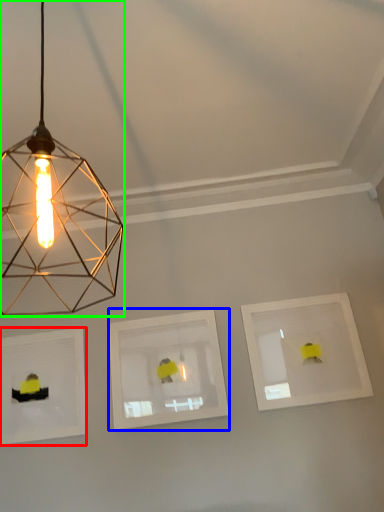
Question: Estimate the real-world distances between objects in this image. Which object is closer to picture frame (highlighted by a red box), picture frame (highlighted by a blue box) or lamp (highlighted by a green box)?

Choices:
 (A) picture frame
 (B) lamp

Answer: (A)